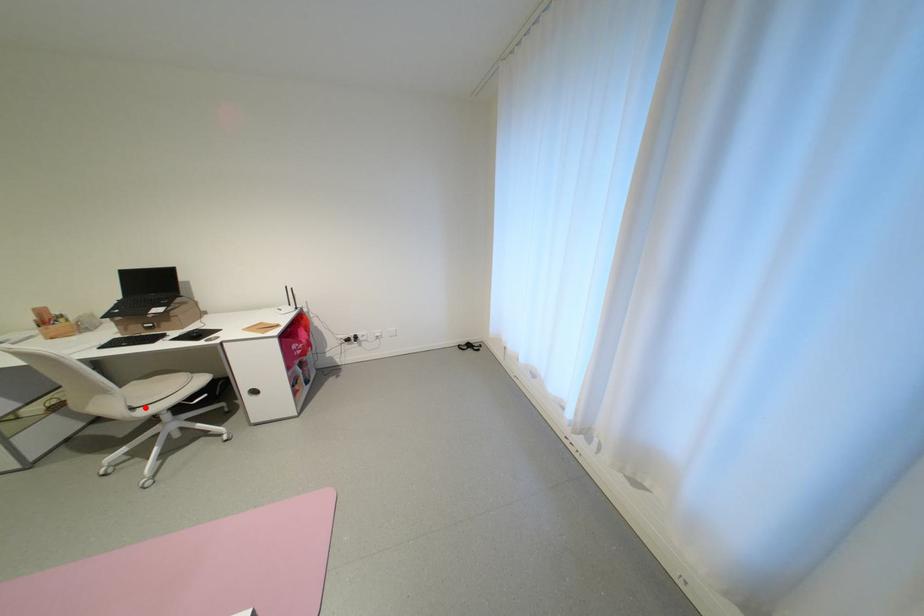
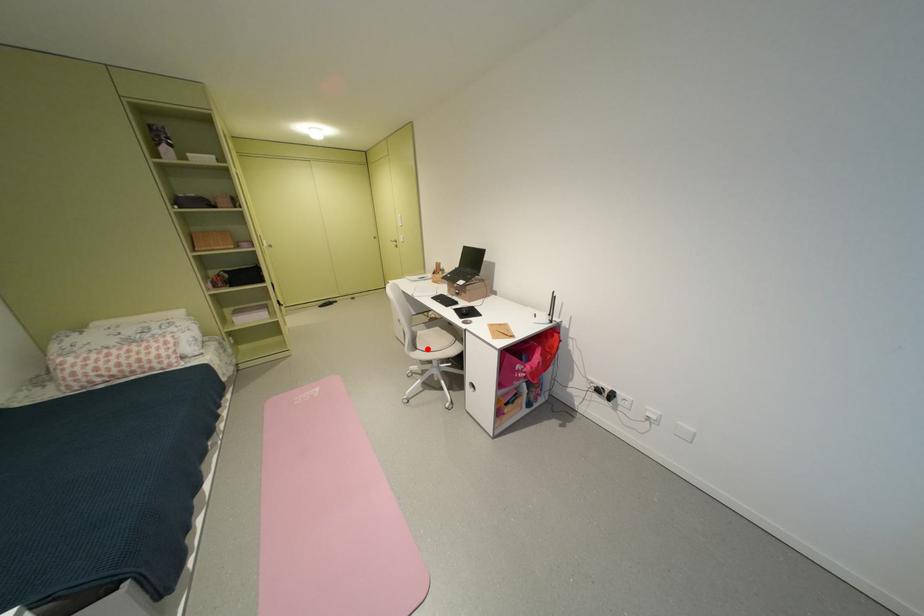
I am providing you with two images of the same scene from different viewpoints. A red point is marked on the first image and another point is marked on the second image. Are the points marked in image1 and image2 representing the same 3D position?

Yes